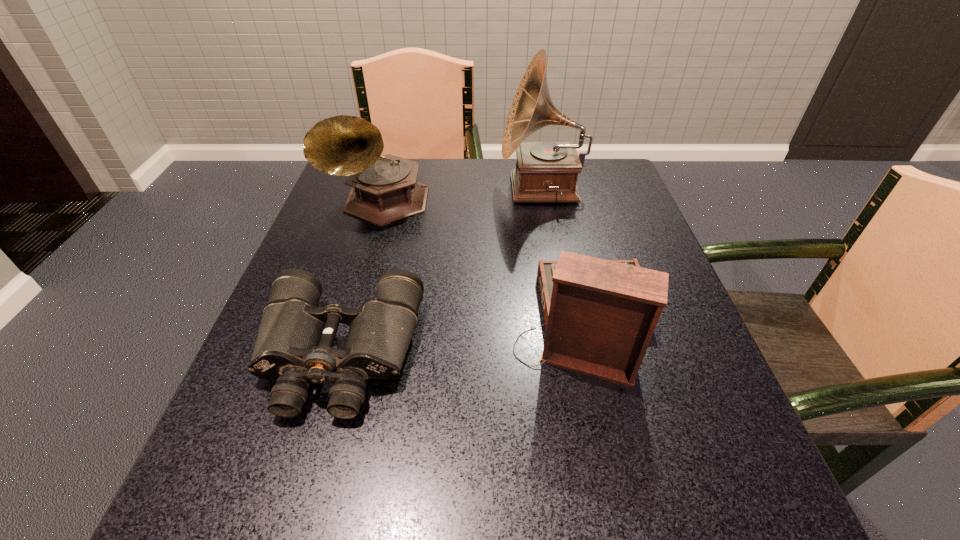
Locate an element on the screen. This screenshot has width=960, height=540. the tallest object is located at coordinates (545, 171).

Where is `the second shortest phonograph record`? The image size is (960, 540). the second shortest phonograph record is located at coordinates (384, 189).

This screenshot has width=960, height=540. Identify the location of the leftmost phonograph record. (384, 189).

Locate an element on the screen. This screenshot has width=960, height=540. the second shortest object is located at coordinates (600, 315).

Find the location of a particular element. the nearest phonograph record is located at coordinates [600, 315].

Where is `binoculars`? The height and width of the screenshot is (540, 960). binoculars is located at coordinates (294, 344).

This screenshot has height=540, width=960. I want to click on blank area located 0.150m on the horn of the tallest object, so click(442, 188).

The width and height of the screenshot is (960, 540). I want to click on free space located on the horn of the tallest object, so click(461, 188).

Locate an element on the screen. vacant space located on the horn of the tallest object is located at coordinates (419, 188).

Locate an element on the screen. Image resolution: width=960 pixels, height=540 pixels. vacant region located on the horn direction of the leftmost phonograph record is located at coordinates (360, 269).